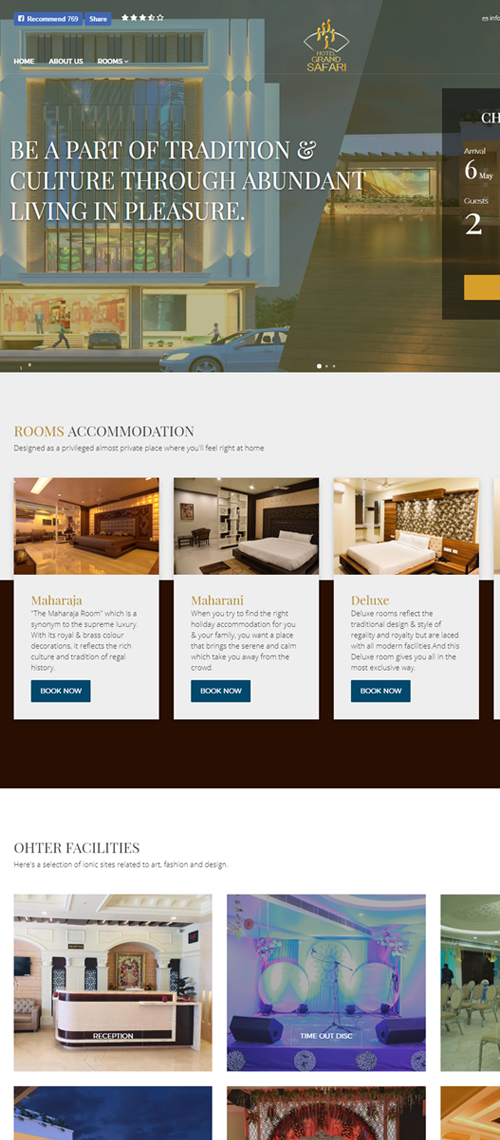
This screenshot has height=1140, width=500. I want to click on chairs, so click(x=486, y=1034), click(x=486, y=1007), click(x=479, y=993), click(x=457, y=1001), click(x=462, y=993), click(x=452, y=991).